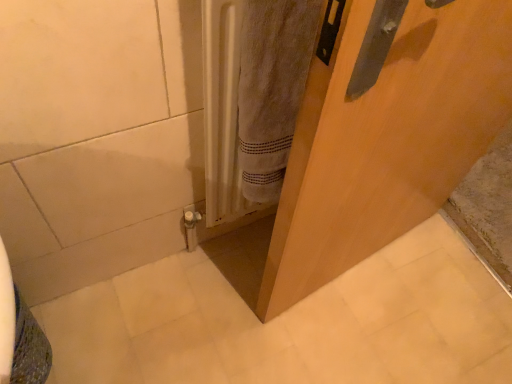
The width and height of the screenshot is (512, 384). Identify the location of wooden door at center. (385, 137).

The height and width of the screenshot is (384, 512). Describe the element at coordinates (385, 137) in the screenshot. I see `wooden door at center` at that location.

At what (x,y) coordinates should I click in order to perform the action: click on wooden door at center. Please return your answer as a coordinate pair (x, y). Looking at the image, I should click on (385, 137).